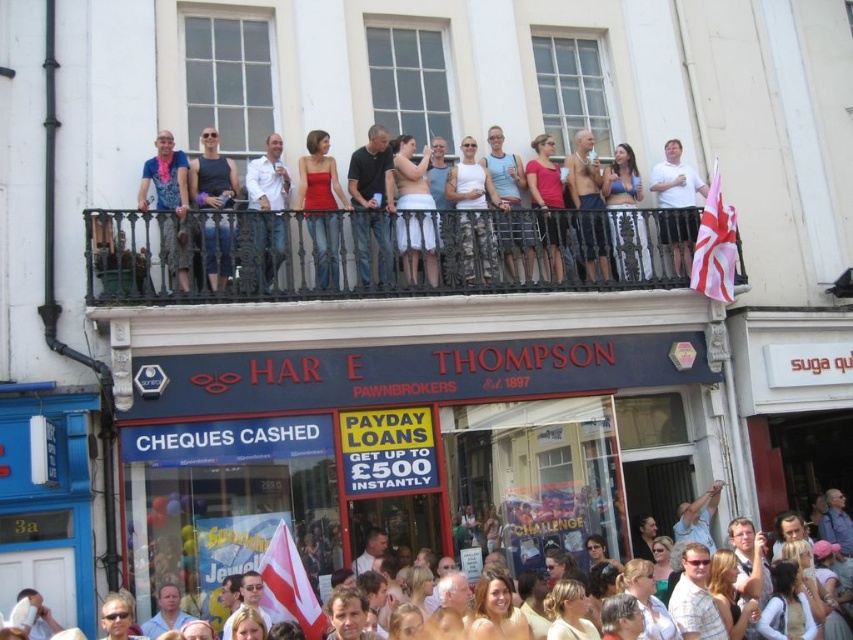
Question: Estimate the real-world distances between objects in this image. Which object is farther from the matte red dress at center?

Choices:
 (A) white cotton shirt at upper center
 (B) pink matte tank top at upper center

Answer: (A)

Question: Can you confirm if matte red dress at center is positioned to the left of white shirt at center?

Choices:
 (A) no
 (B) yes

Answer: (A)

Question: Is matte black tank top at center behind white cotton shirt at upper center?

Choices:
 (A) yes
 (B) no

Answer: (B)

Question: Estimate the real-world distances between objects in this image. Which object is farther from the shiny blue shorts at center?

Choices:
 (A) white cotton shirt at upper center
 (B) matte red dress at center

Answer: (B)

Question: Which of the following is the closest to the observer?

Choices:
 (A) blue printed shirt at upper left
 (B) dark blue jeans at center

Answer: (A)

Question: Is matte white skirt at center to the right of white shirt at center from the viewer's perspective?

Choices:
 (A) no
 (B) yes

Answer: (B)